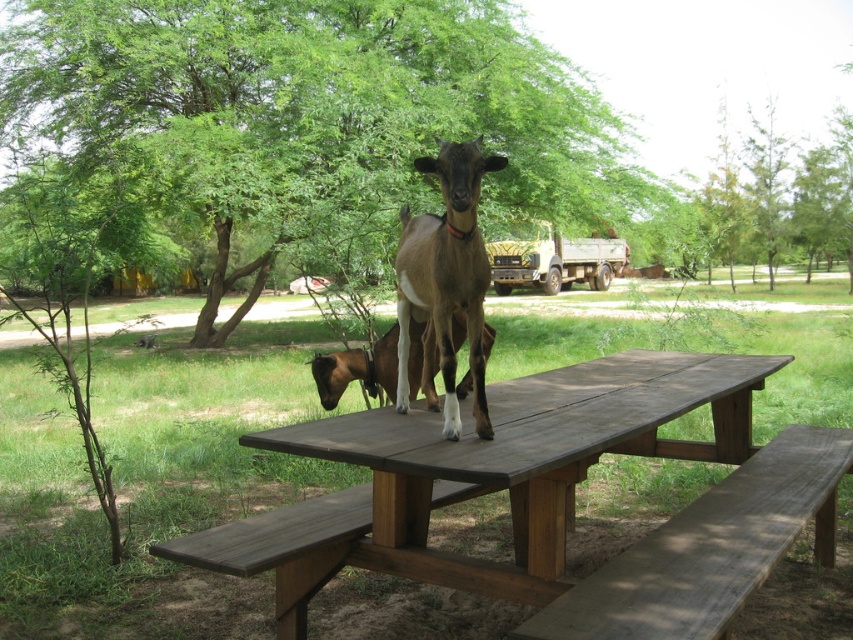
You are sitting on the wooden bench at lower right and want to look at the brown fur goat at center. Can you see it without moving from your seat?

Yes, because the wooden bench at lower right is in front of the brown fur goat at center, so the goat is behind the bench and you can see it from your seat.

You are standing in front of the picnic table and want to place a small basket on the dark brown wood at center. However, there is a brown fur goat at center on the table. Can you place the basket there without disturbing the goat?

The dark brown wood at center is closer to the viewer than the brown fur goat at center, so the goat is actually behind the wooden surface. This means you can place the basket on the dark brown wood at center without disturbing the goat since the goat is positioned behind it.

You are standing at the picnic table and want to find the point at coordinate (311, 108). Where would you look?

The point at coordinate (311, 108) is on the green leafy tree at center.